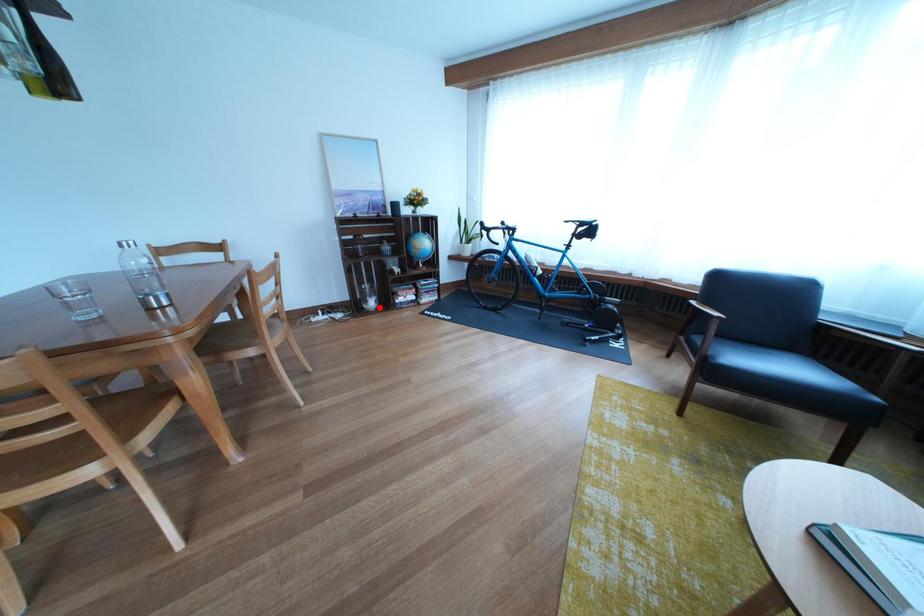
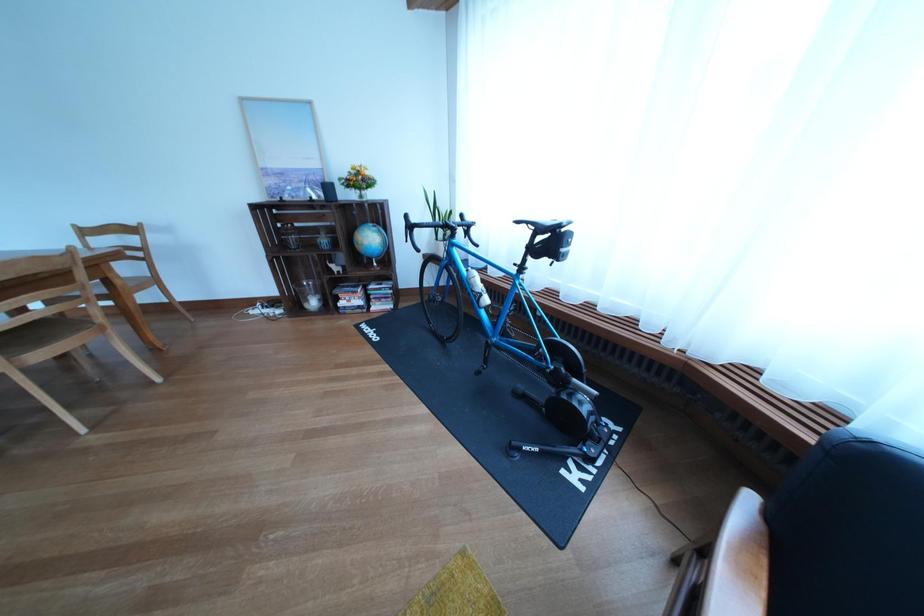
Where in the second image is the point corresponding to the highlighted location from the first image?

(321, 306)